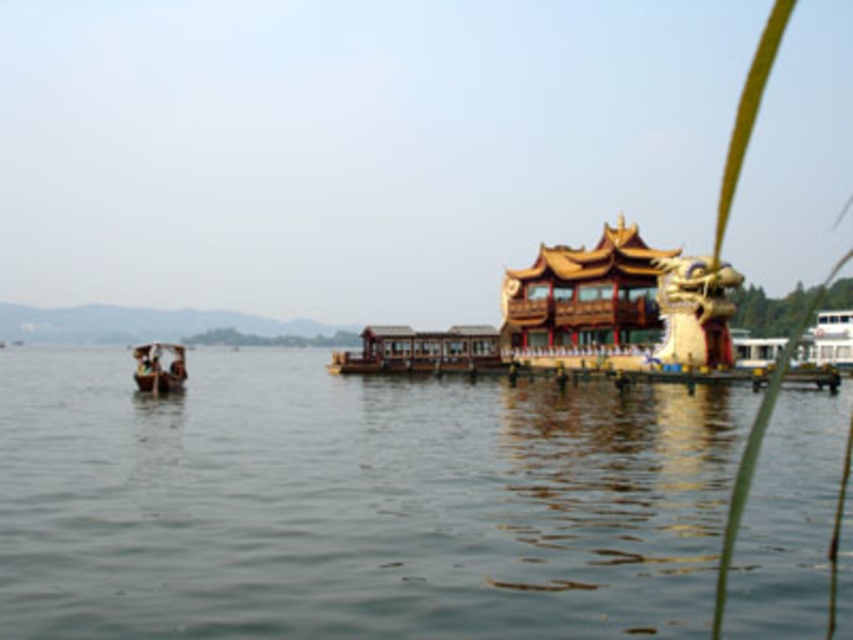
You are a tourist visiting the lakeside and want to take a photo of the pavilion. You notice the transparent water at center and the wooden boat at left in the scene. Which object should you focus on if you want to capture the largest element in the frame?

The transparent water at center should be focused on because it has a larger size compared to the wooden boat at left, making it the largest element in the frame.